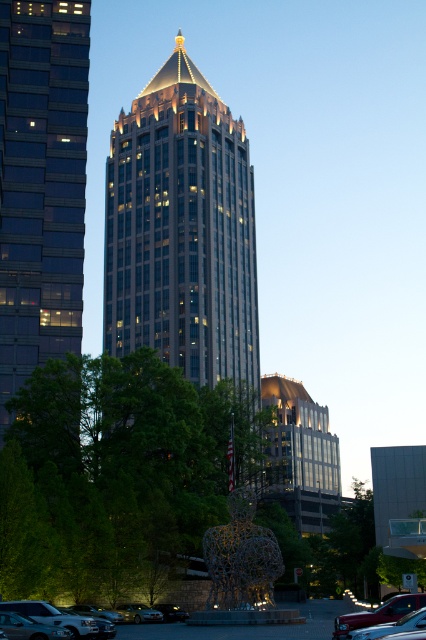
Question: Which point is closer to the camera?

Choices:
 (A) metallic maroon car at lower right
 (B) shiny silver sedan at lower left
 (C) shiny silver car at lower center
 (D) metallic silver car at lower left

Answer: (B)

Question: From the image, what is the correct spatial relationship of shiny silver sedan at lower left in relation to metallic silver car at lower left?

Choices:
 (A) below
 (B) above

Answer: (B)

Question: Estimate the real-world distances between objects in this image. Which object is closer to the glassy reflective skyscraper at left?

Choices:
 (A) metallic silver car at lower left
 (B) shiny silver sedan at lower left
 (C) shiny silver car at lower center
 (D) metallic maroon car at lower right

Answer: (C)

Question: Is metallic maroon car at lower right positioned before shiny silver sedan at lower left?

Choices:
 (A) yes
 (B) no

Answer: (B)

Question: From the image, what is the correct spatial relationship of glassy reflective skyscraper at left in relation to shiny silver sedan at lower left?

Choices:
 (A) above
 (B) below

Answer: (A)

Question: Which point appears closest to the camera in this image?

Choices:
 (A) (330, 625)
 (B) (359, 620)
 (C) (201, 237)
 (D) (143, 616)

Answer: (B)